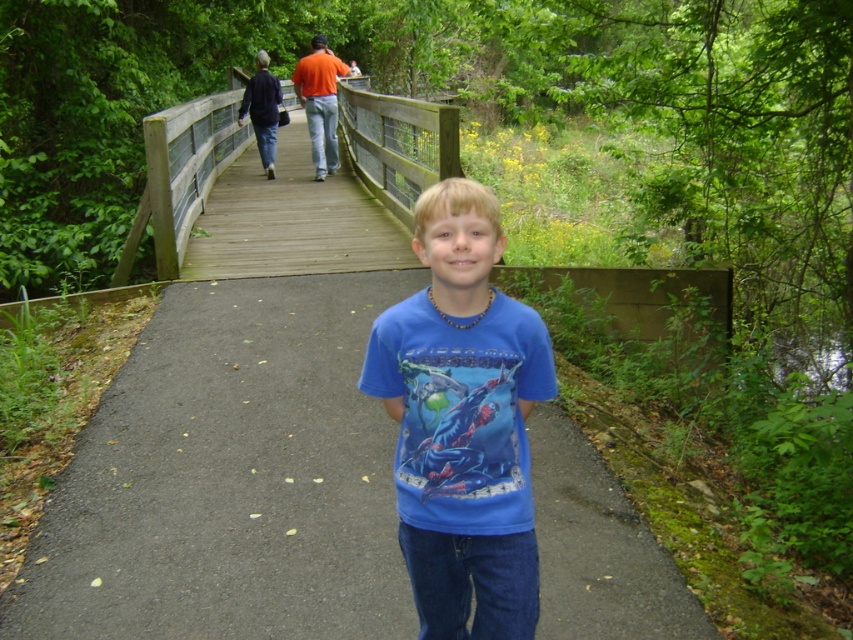
Question: Among these objects, which one is farthest from the camera?

Choices:
 (A) blue cotton shirt at center
 (B) blue t-shirt at center

Answer: (B)

Question: Which of the following is the closest to the observer?

Choices:
 (A) blue cotton shirt at center
 (B) blue t-shirt at center

Answer: (A)

Question: Which object is the closest to the blue t-shirt at center?

Choices:
 (A) wooden bridge at upper center
 (B) blue cotton shirt at center

Answer: (B)

Question: Does blue t-shirt at center appear under wooden bridge at upper center?

Choices:
 (A) yes
 (B) no

Answer: (A)

Question: Is blue cotton shirt at center closer to camera compared to wooden bridge at upper center?

Choices:
 (A) yes
 (B) no

Answer: (A)

Question: Can you confirm if blue cotton shirt at center is positioned below wooden bridge at upper center?

Choices:
 (A) yes
 (B) no

Answer: (A)